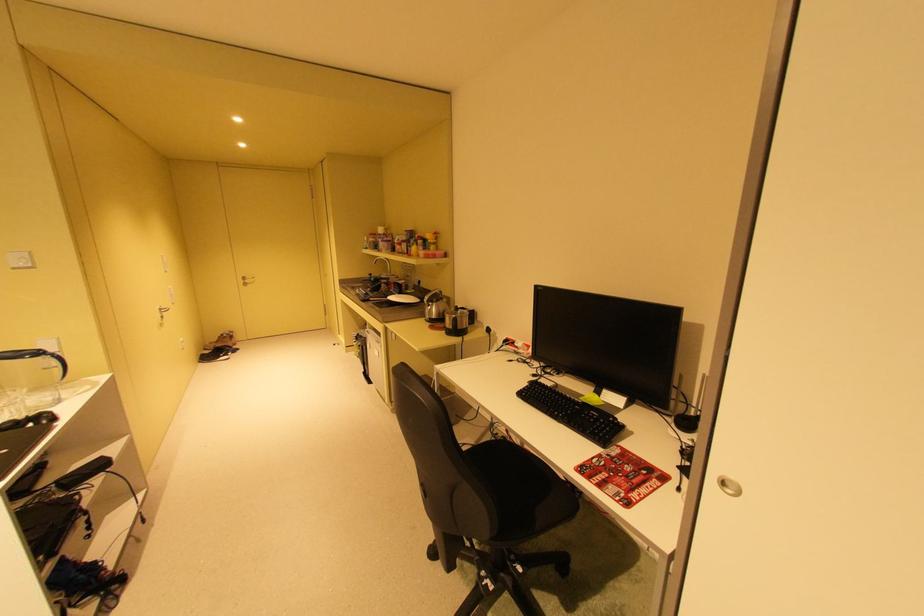
What do you see at coordinates (383, 262) in the screenshot? I see `the faucet handle` at bounding box center [383, 262].